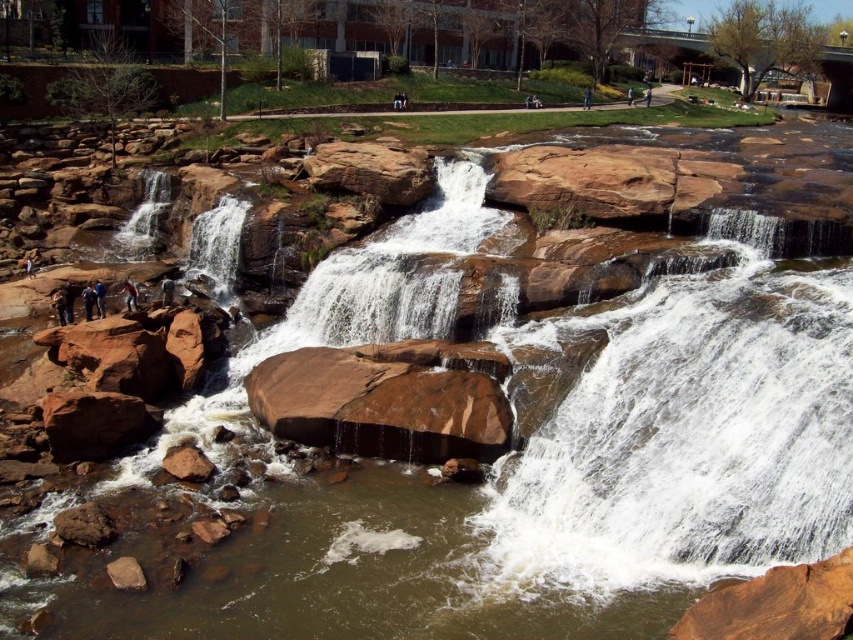
Question: Which point is closer to the camera?

Choices:
 (A) dark blue jeans at left
 (B) brown leather jacket at left
 (C) blue denim jeans at center

Answer: (A)

Question: Is brown leather jacket at upper center positioned behind brown leather jacket at center?

Choices:
 (A) no
 (B) yes

Answer: (A)

Question: Among these points, which one is farthest from the camera?

Choices:
 (A) (749, 474)
 (B) (90, 312)

Answer: (B)

Question: Can you confirm if blue denim jeans at lower left is bigger than brown leather jacket at upper center?

Choices:
 (A) no
 (B) yes

Answer: (A)

Question: Does dark brown leather jacket at left have a larger size compared to brown leather jacket at center?

Choices:
 (A) yes
 (B) no

Answer: (B)

Question: Which point is closer to the camera?

Choices:
 (A) brown rough rock at lower left
 (B) blue denim jeans at lower left
 (C) dark blue jeans at left

Answer: (A)